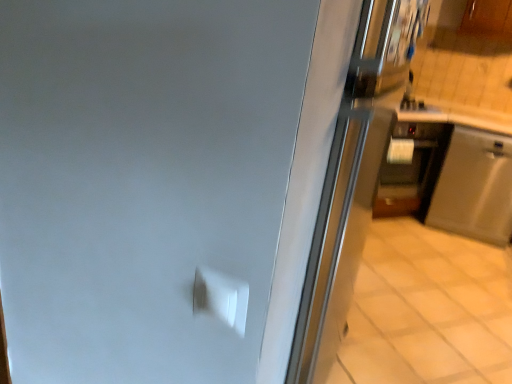
Question: Should I look upward or downward to see satin silver dishwasher at lower right?

Choices:
 (A) down
 (B) up

Answer: (B)